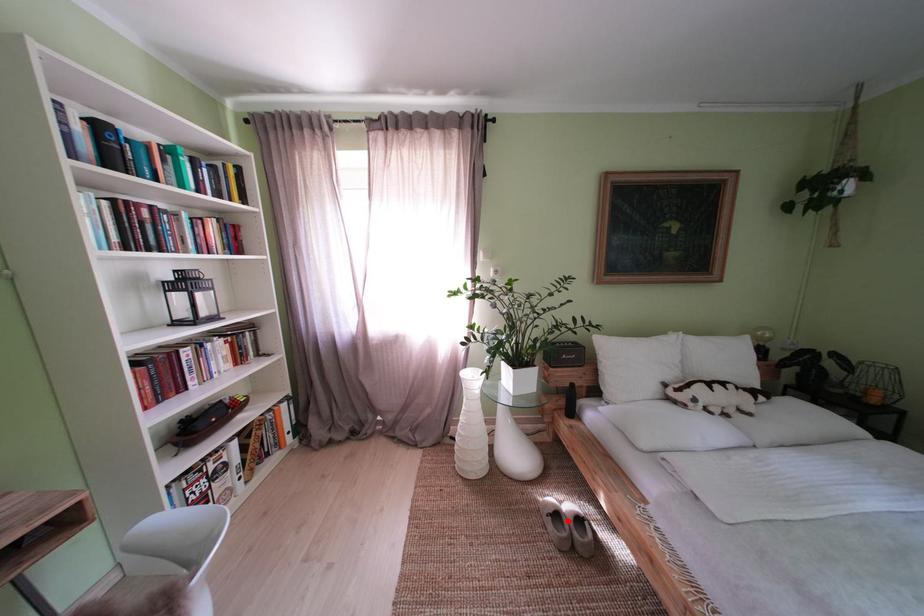
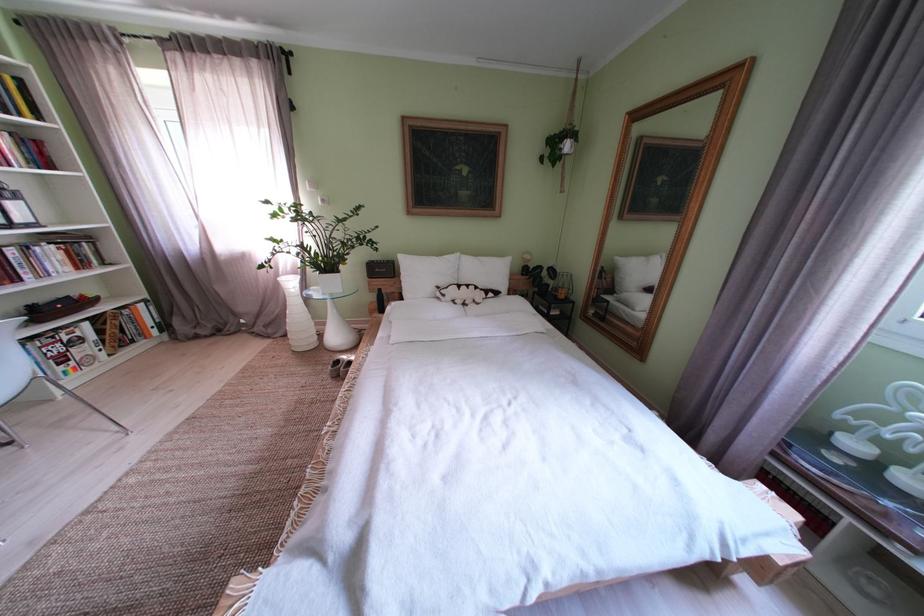
The point at the highlighted location is marked in the first image. Where is the corresponding point in the second image?

(348, 367)